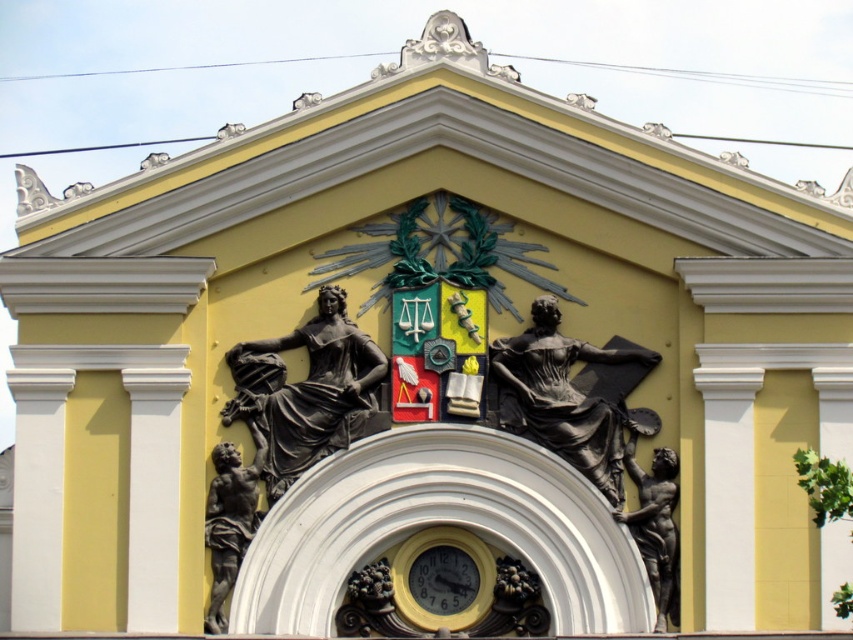
Question: Which object is positioned farthest from the bronze statue at center?

Choices:
 (A) metallic gold clock at center
 (B) bronze statue at lower left
 (C) bronze statue at right

Answer: (B)

Question: In this image, where is black polished statue at center located relative to bronze statue at center?

Choices:
 (A) below
 (B) above

Answer: (B)

Question: Is bronze statue at right to the right of metallic clock face at center from the viewer's perspective?

Choices:
 (A) no
 (B) yes

Answer: (B)

Question: Considering the real-world distances, which object is closest to the bronze statue at right?

Choices:
 (A) black polished statue at center
 (B) metallic clock face at center
 (C) metallic gold clock at center
 (D) bronze statue at center

Answer: (D)

Question: Is metallic gold clock at center thinner than bronze statue at lower left?

Choices:
 (A) yes
 (B) no

Answer: (B)

Question: Among these points, which one is nearest to the camera?

Choices:
 (A) (459, 586)
 (B) (631, 467)
 (C) (277, 497)
 (D) (416, 586)

Answer: (C)